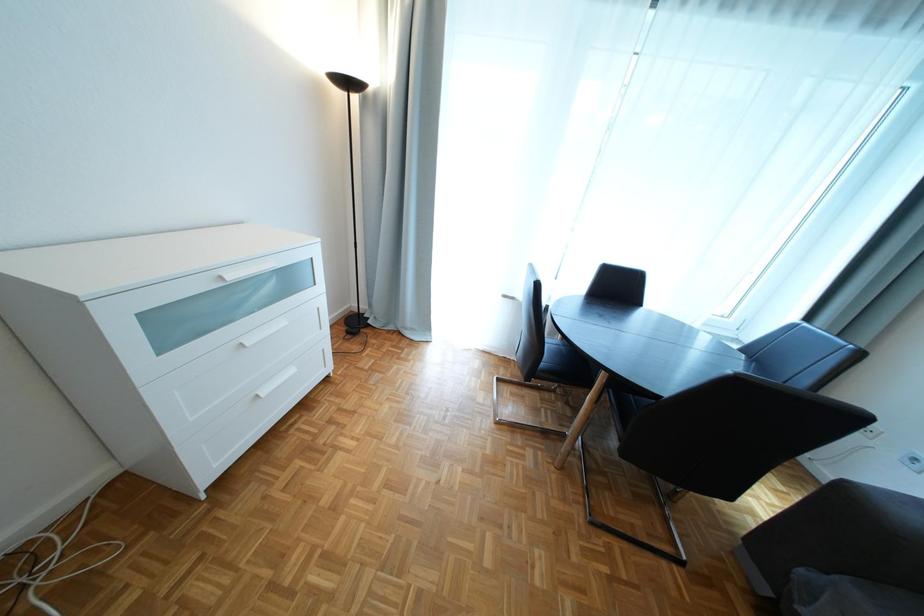
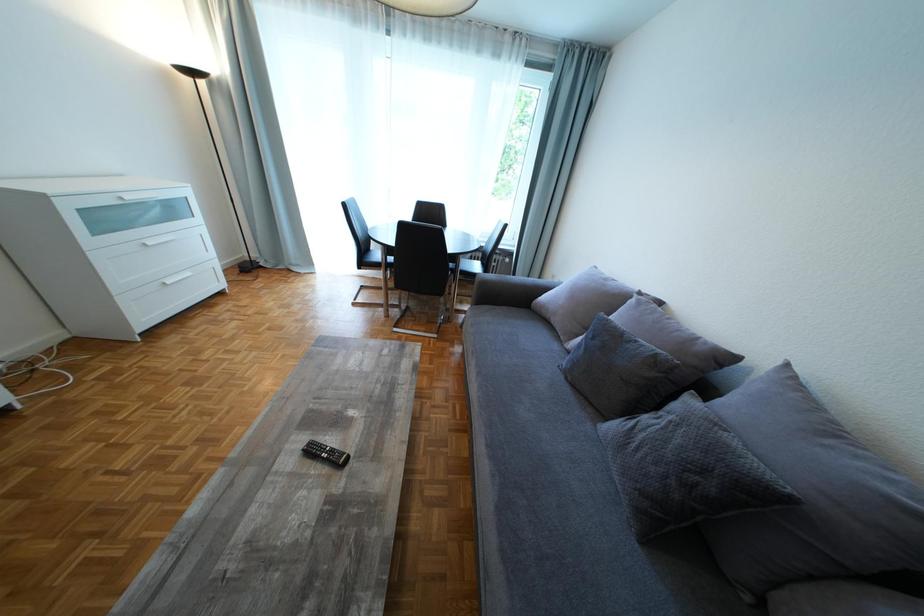
The images are taken continuously from a first-person perspective. In which direction are you moving?

The cameraman walked toward right, backward.